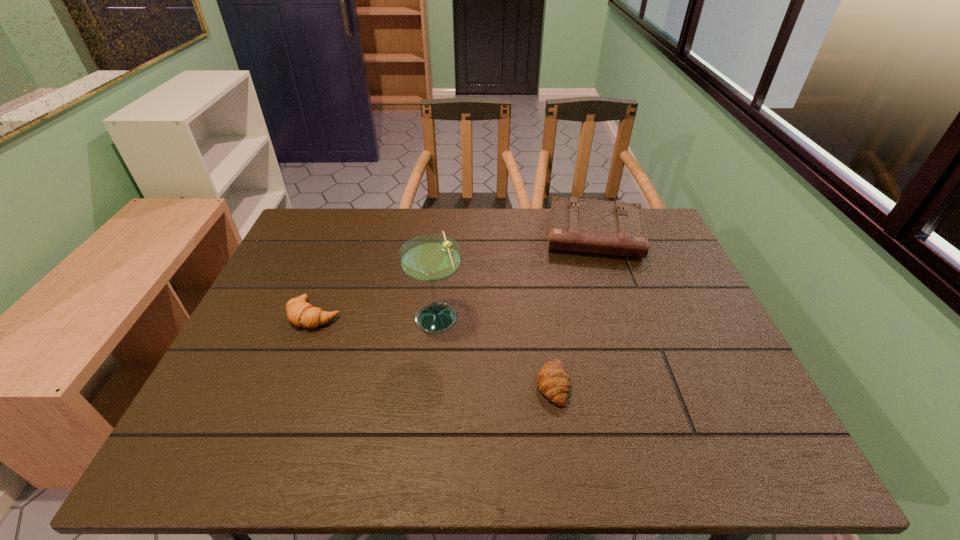
Find the location of a particular element. free space at the far left corner of the desktop is located at coordinates (345, 215).

At what (x,y) coordinates should I click in order to perform the action: click on vacant area at the near left corner of the desktop. Please return your answer as a coordinate pair (x, y). The height and width of the screenshot is (540, 960). Looking at the image, I should click on (196, 440).

This screenshot has height=540, width=960. Identify the location of free point between the hardback book and the third object from left to right. (574, 309).

The width and height of the screenshot is (960, 540). In order to click on free area in between the farther crescent roll and the second tallest object in this screenshot , I will do `click(455, 275)`.

This screenshot has height=540, width=960. Identify the location of vacant space in between the rightmost object and the nearer crescent roll. (574, 309).

Identify the location of unoccupied position between the hardback book and the left crescent roll. The height and width of the screenshot is (540, 960). (455, 275).

Identify the location of vacant region between the rightmost object and the nearer crescent roll. The image size is (960, 540). pos(574,309).

Image resolution: width=960 pixels, height=540 pixels. Identify the location of empty space between the third object from left to right and the rightmost object. (574, 309).

The width and height of the screenshot is (960, 540). Find the location of `free spot between the left crescent roll and the nearer crescent roll`. free spot between the left crescent roll and the nearer crescent roll is located at coordinates (434, 349).

Find the location of a particular element. The image size is (960, 540). vacant area between the third object from right to left and the nearest object is located at coordinates (494, 350).